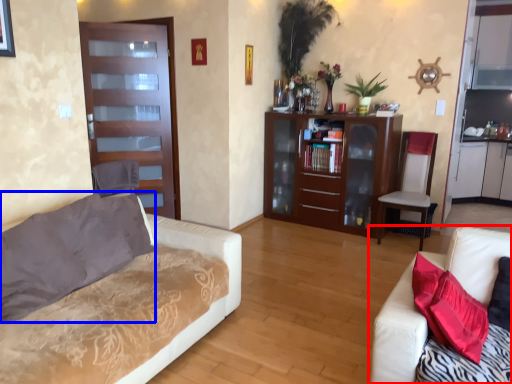
Question: Which object appears farthest to the camera in this image, studio couch (highlighted by a red box) or pillow (highlighted by a blue box)?

Choices:
 (A) studio couch
 (B) pillow

Answer: (B)